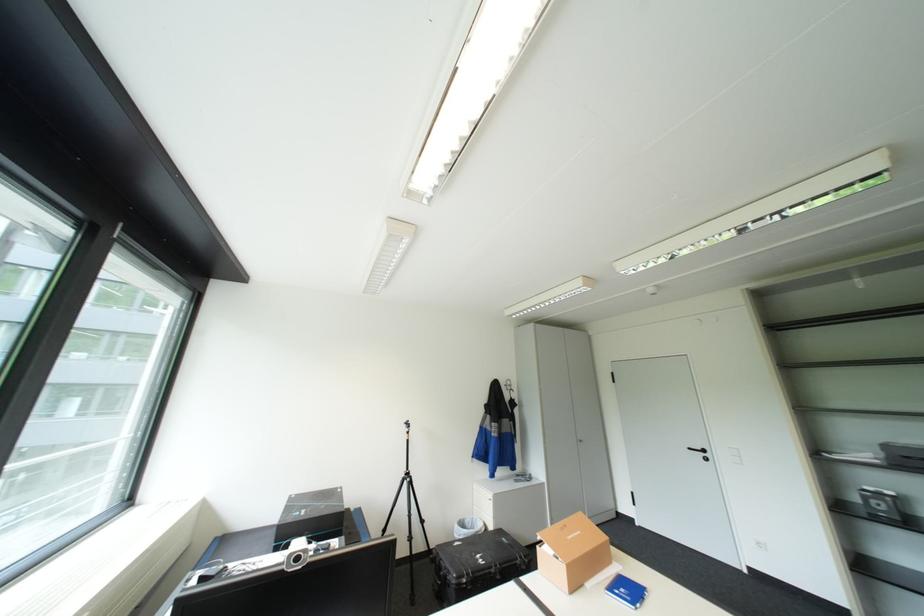
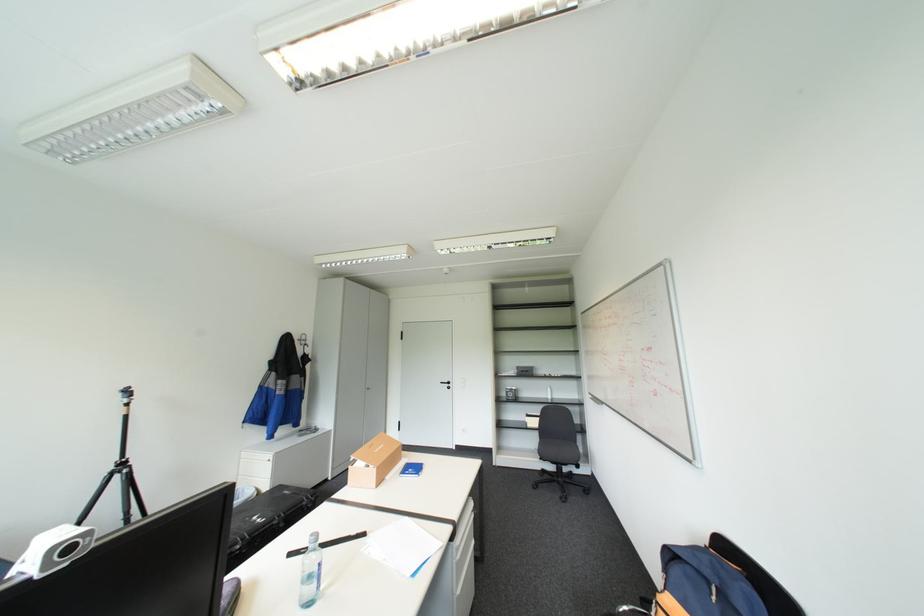
Where in the second image is the point corresponding to [698,447] from the first image?

(450, 381)